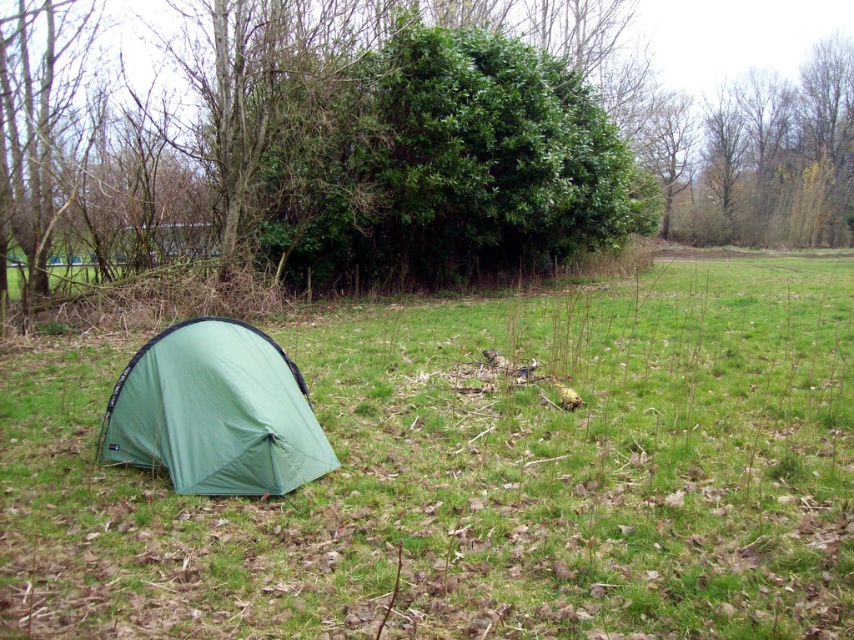
Question: Is green fabric tent at left thinner than green nylon tent at lower left?

Choices:
 (A) yes
 (B) no

Answer: (B)

Question: Considering the real-world distances, which object is farthest from the green leafy bush at center?

Choices:
 (A) green nylon tent at lower left
 (B) green fabric tent at left

Answer: (A)

Question: Can you confirm if green fabric tent at left is smaller than green leafy bush at center?

Choices:
 (A) yes
 (B) no

Answer: (A)

Question: Does green fabric tent at left appear on the left side of green nylon tent at lower left?

Choices:
 (A) yes
 (B) no

Answer: (B)

Question: Which of the following is the closest to the observer?

Choices:
 (A) (495, 448)
 (B) (729, 166)
 (C) (147, 346)

Answer: (C)

Question: Which object appears farthest from the camera in this image?

Choices:
 (A) green nylon tent at lower left
 (B) green leafy bush at center

Answer: (B)